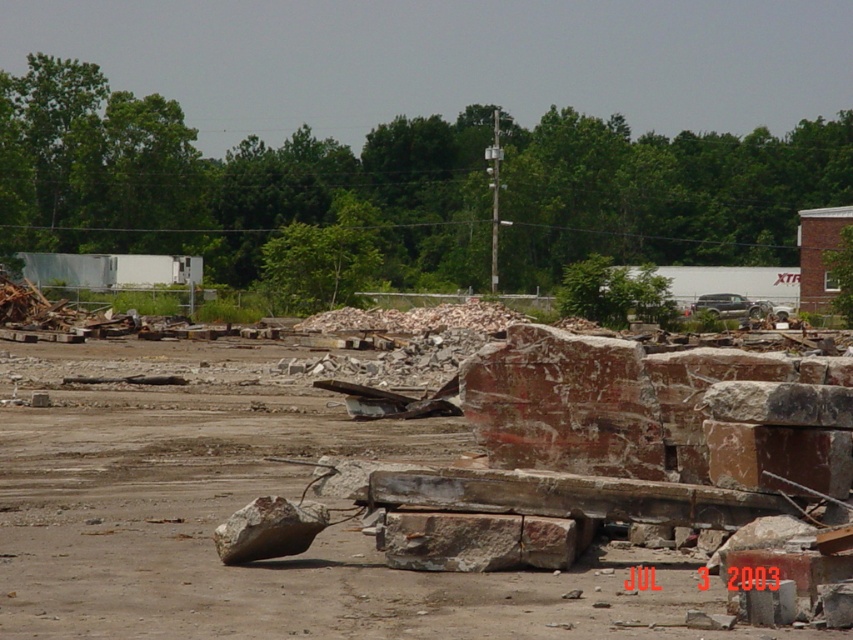
Locate an element on the screen. The height and width of the screenshot is (640, 853). brown rough stone at center is located at coordinates (476, 541).

Is point (503, 515) farther from viewer compared to point (312, 512)?

No, (503, 515) is closer to viewer.

This screenshot has width=853, height=640. In order to click on brown rough stone at center in this screenshot , I will do `click(476, 541)`.